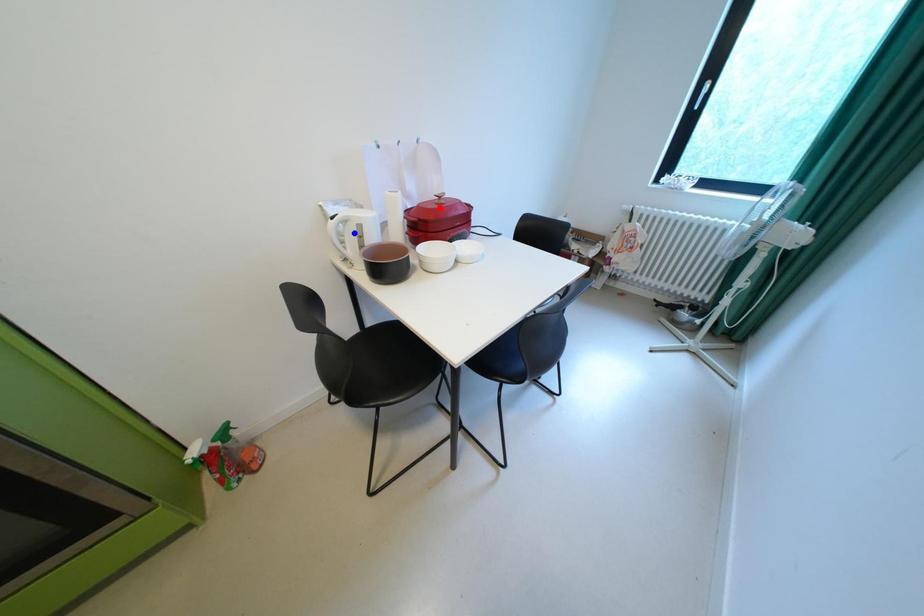
Question: Which of the two points in the image is closer to the camera?

Choices:
 (A) Blue point is closer.
 (B) Red point is closer.

Answer: (A)